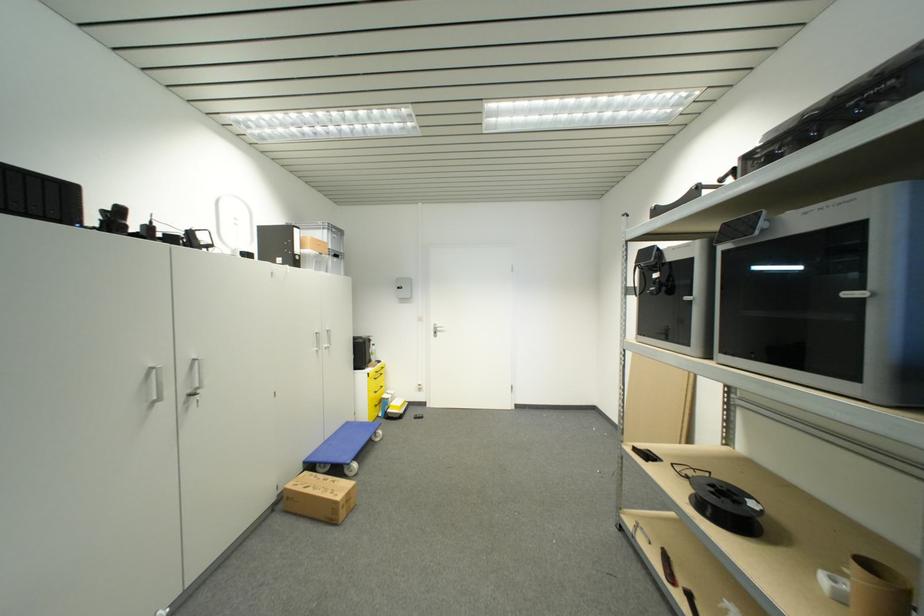
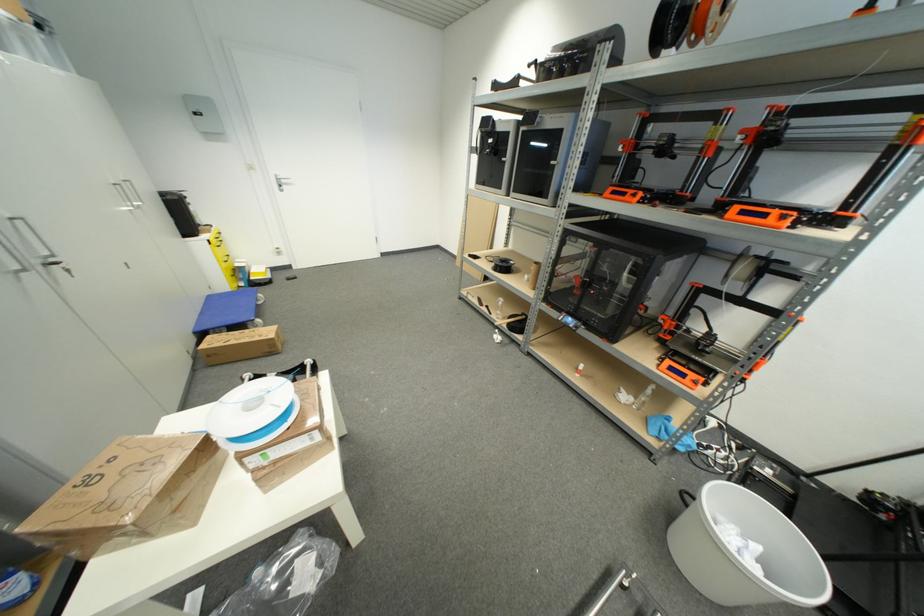
Locate, in the second image, the point that corresponds to pixel 436 336 in the first image.

(281, 188)